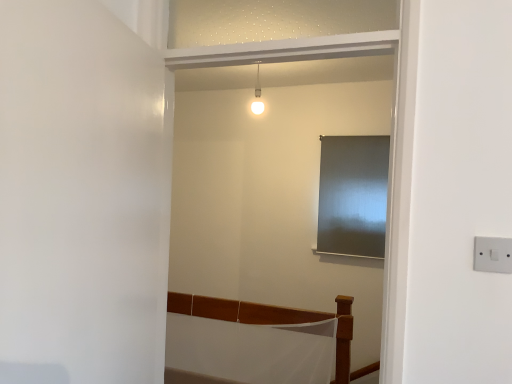
Question: From a real-world perspective, is white glossy light fixture at upper center beneath white matte door at left?

Choices:
 (A) yes
 (B) no

Answer: (B)

Question: From a real-world perspective, is white glossy light fixture at upper center physically above white matte door at left?

Choices:
 (A) no
 (B) yes

Answer: (B)

Question: Is white matte door at left at the back of white glossy light fixture at upper center?

Choices:
 (A) yes
 (B) no

Answer: (B)

Question: Is white matte door at left inside white glossy light fixture at upper center?

Choices:
 (A) no
 (B) yes

Answer: (A)

Question: Considering the relative sizes of white glossy light fixture at upper center and white matte door at left in the image provided, is white glossy light fixture at upper center bigger than white matte door at left?

Choices:
 (A) yes
 (B) no

Answer: (B)

Question: Can you confirm if white glossy light fixture at upper center is positioned to the left of white matte door at left?

Choices:
 (A) yes
 (B) no

Answer: (B)

Question: From the image's perspective, is white matte door at left under white plastic switch at right?

Choices:
 (A) no
 (B) yes

Answer: (A)

Question: Is white matte door at left at the left side of white plastic switch at right?

Choices:
 (A) yes
 (B) no

Answer: (A)

Question: Does white matte door at left have a lesser width compared to white plastic switch at right?

Choices:
 (A) yes
 (B) no

Answer: (B)

Question: Is white matte door at left at the right side of white plastic switch at right?

Choices:
 (A) yes
 (B) no

Answer: (B)

Question: Is white matte door at left positioned far away from white plastic switch at right?

Choices:
 (A) yes
 (B) no

Answer: (B)

Question: Does white matte door at left touch white plastic switch at right?

Choices:
 (A) no
 (B) yes

Answer: (A)

Question: Does white matte door at left come behind wooden bed frame at lower center?

Choices:
 (A) no
 (B) yes

Answer: (A)